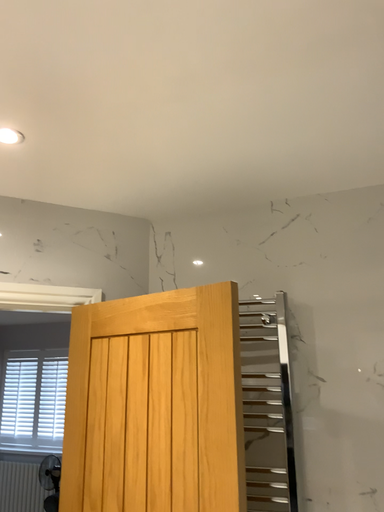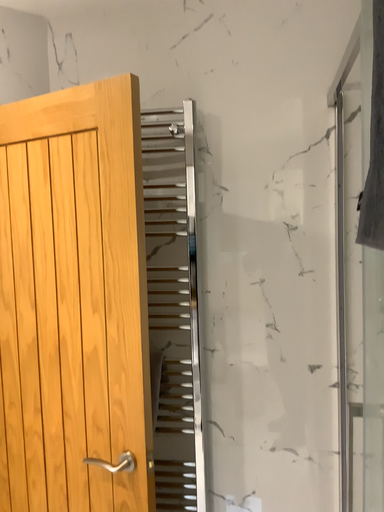
Question: Which way did the camera rotate in the video?

Choices:
 (A) rotated downward
 (B) rotated upward

Answer: (A)